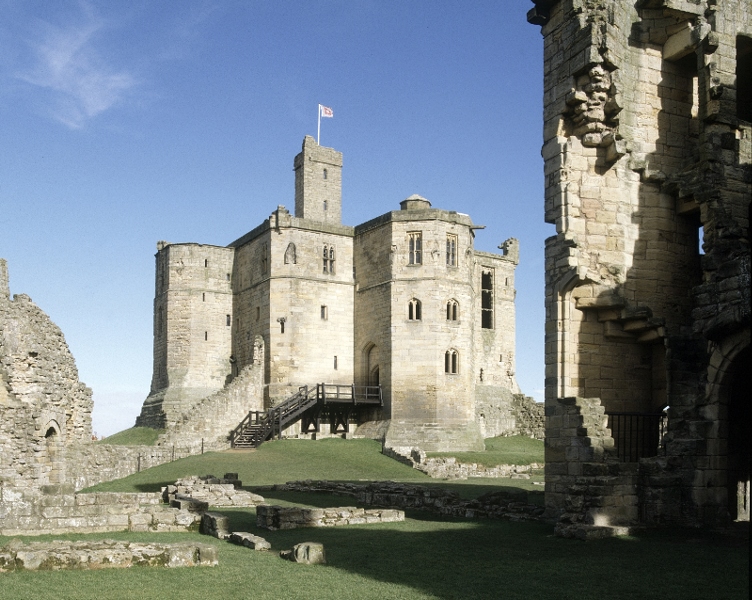
Identify the location of wooden stairs. Image resolution: width=752 pixels, height=600 pixels. (282, 414).